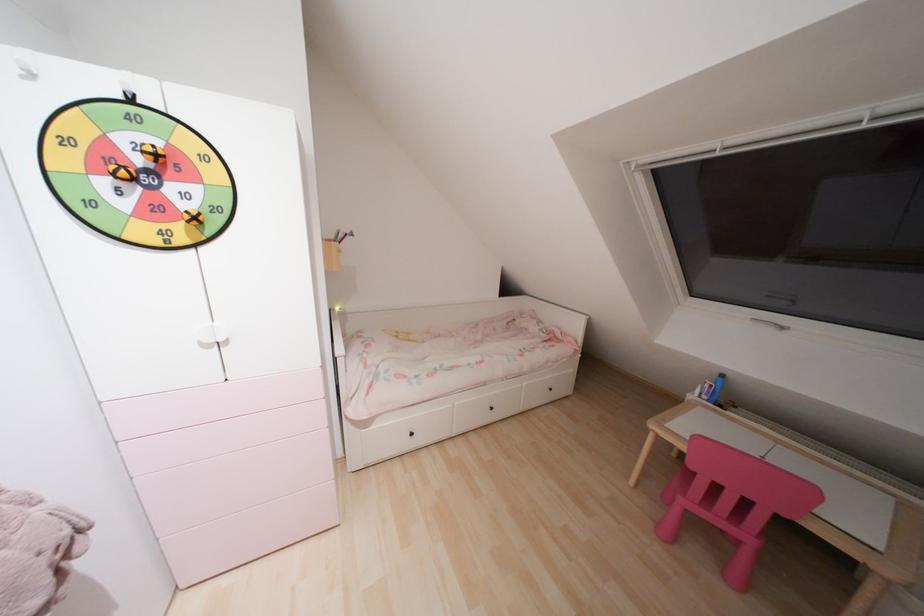
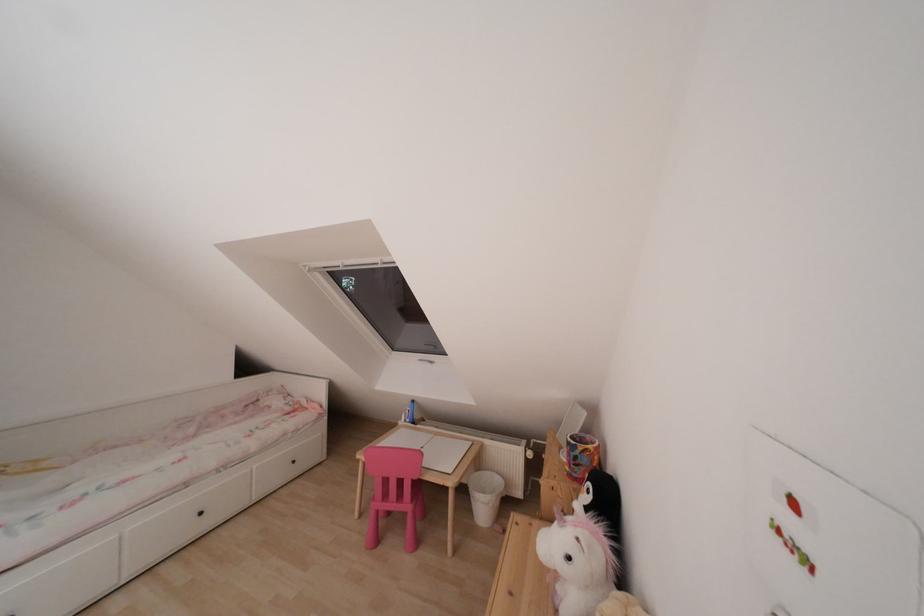
Question: The images are taken continuously from a first-person perspective. In which direction is your viewpoint rotating?

Choices:
 (A) Left
 (B) Right
 (C) Up
 (D) Down

Answer: (B)